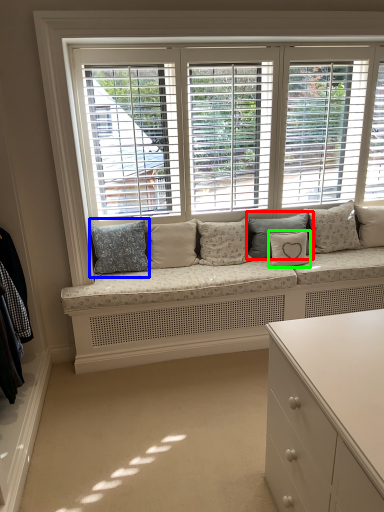
Question: Based on their relative distances, which object is nearer to pillow (highlighted by a red box)? Choose from pillow (highlighted by a blue box) and pillow (highlighted by a green box).

Choices:
 (A) pillow
 (B) pillow

Answer: (B)